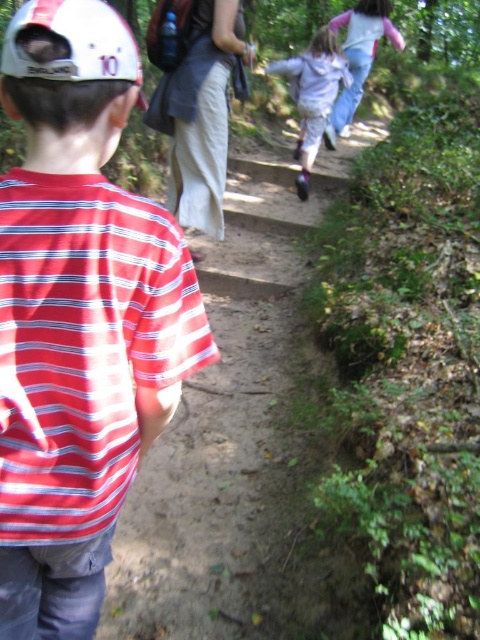
What is located at the coordinates point (79, 316)?

The striped cotton shirt at center is located at point (79, 316).

You are standing at the point marked by the coordinates point (x=231, y=426). Looking towards the direction of the dirt path at center, which direction should you walk to reach the young boy wearing a red and white striped shirt and a white helmet with

The dirt path at center is represented by point (x=231, y=426). To reach the young boy, you should walk in the direction of the dirt path at center since he is positioned in the foreground along the path.